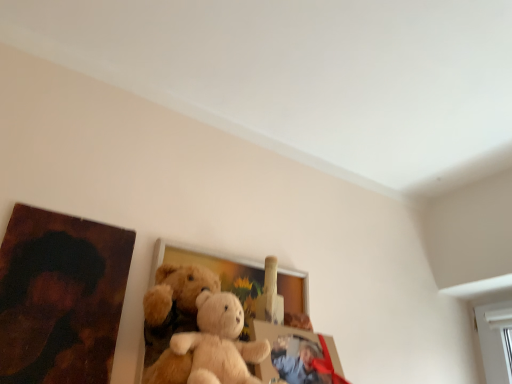
The height and width of the screenshot is (384, 512). I want to click on wooden painting at left, which ranks as the 3th picture frame in right-to-left order, so click(60, 297).

Identify the location of picture frame that is above the wooden picture frame at center, which is the 2th picture frame in right-to-left order (from the image's perspective). (60, 297).

Based on the photo, considering the relative positions of wooden picture frame at center, which is the 2th picture frame from left to right, and wooden painting at left, which ranks as the 3th picture frame in right-to-left order, in the image provided, is wooden picture frame at center, which is the 2th picture frame from left to right, behind wooden painting at left, which ranks as the 3th picture frame in right-to-left order,?

Yes.

Can you confirm if wooden picture frame at center, which is the 2th picture frame in right-to-left order, is positioned to the left of wooden painting at left, acting as the 1th picture frame starting from the left?

No, wooden picture frame at center, which is the 2th picture frame in right-to-left order, is not to the left of wooden painting at left, acting as the 1th picture frame starting from the left.

Can you confirm if matte plastic picture frame at center, the 1th picture frame from the right, is positioned to the left of wooden painting at left, acting as the 1th picture frame starting from the left?

No, matte plastic picture frame at center, the 1th picture frame from the right, is not to the left of wooden painting at left, acting as the 1th picture frame starting from the left.

Based on the photo, which object is closer to the camera, matte plastic picture frame at center, the 1th picture frame from the right, or wooden painting at left, which ranks as the 3th picture frame in right-to-left order?

Positioned in front is wooden painting at left, which ranks as the 3th picture frame in right-to-left order.

From their relative heights in the image, would you say matte plastic picture frame at center, the third picture frame viewed from the left, is taller or shorter than wooden painting at left, acting as the 1th picture frame starting from the left?

Considering their sizes, matte plastic picture frame at center, the third picture frame viewed from the left, has less height than wooden painting at left, acting as the 1th picture frame starting from the left.

Is matte plastic picture frame at center, the third picture frame viewed from the left, positioned beyond the bounds of wooden painting at left, acting as the 1th picture frame starting from the left?

Absolutely, matte plastic picture frame at center, the third picture frame viewed from the left, is external to wooden painting at left, acting as the 1th picture frame starting from the left.

Is wooden painting at left, acting as the 1th picture frame starting from the left, next to wooden picture frame at center, which is the 2th picture frame from left to right, and touching it?

They are not placed beside each other.

Who is smaller, wooden painting at left, acting as the 1th picture frame starting from the left, or wooden picture frame at center, which is the 2th picture frame from left to right?

Smaller between the two is wooden painting at left, acting as the 1th picture frame starting from the left.

Is point (109, 255) more distant than point (252, 284)?

No, it is in front of (252, 284).

Is wooden painting at left, acting as the 1th picture frame starting from the left, shorter than wooden picture frame at center, which is the 2th picture frame in right-to-left order?

Yes, wooden painting at left, acting as the 1th picture frame starting from the left, is shorter than wooden picture frame at center, which is the 2th picture frame in right-to-left order.

Is wooden picture frame at center, which is the 2th picture frame in right-to-left order, far away from matte plastic picture frame at center, the third picture frame viewed from the left?

No, wooden picture frame at center, which is the 2th picture frame in right-to-left order, is in close proximity to matte plastic picture frame at center, the third picture frame viewed from the left.

Is wooden picture frame at center, which is the 2th picture frame in right-to-left order, situated inside matte plastic picture frame at center, the third picture frame viewed from the left, or outside?

The correct answer is: outside.

Locate an element on the screen. The width and height of the screenshot is (512, 384). picture frame lying below the wooden picture frame at center, which is the 2th picture frame in right-to-left order (from the image's perspective) is located at coordinates (297, 356).

Is point (158, 367) farther from camera compared to point (272, 353)?

No, (158, 367) is closer to viewer.

Would you say matte plastic picture frame at center, the 1th picture frame from the right, is inside or outside wooden picture frame at center, which is the 2th picture frame from left to right?

matte plastic picture frame at center, the 1th picture frame from the right, is not inside wooden picture frame at center, which is the 2th picture frame from left to right, it's outside.

Is matte plastic picture frame at center, the third picture frame viewed from the left, looking in the opposite direction of wooden picture frame at center, which is the 2th picture frame from left to right?

Yes, matte plastic picture frame at center, the third picture frame viewed from the left, is positioned with its back facing wooden picture frame at center, which is the 2th picture frame from left to right.

Between matte plastic picture frame at center, the third picture frame viewed from the left, and wooden picture frame at center, which is the 2th picture frame in right-to-left order, which one has smaller width?

wooden picture frame at center, which is the 2th picture frame in right-to-left order.

Considering the positions of objects wooden painting at left, acting as the 1th picture frame starting from the left, and matte plastic picture frame at center, the 1th picture frame from the right, in the image provided, who is behind, wooden painting at left, acting as the 1th picture frame starting from the left, or matte plastic picture frame at center, the 1th picture frame from the right,?

matte plastic picture frame at center, the 1th picture frame from the right, is more distant.

How distant is wooden painting at left, which ranks as the 3th picture frame in right-to-left order, from matte plastic picture frame at center, the third picture frame viewed from the left?

15.82 inches.

From the image's perspective, is wooden painting at left, acting as the 1th picture frame starting from the left, located above or below matte plastic picture frame at center, the 1th picture frame from the right?

wooden painting at left, acting as the 1th picture frame starting from the left, is situated higher than matte plastic picture frame at center, the 1th picture frame from the right, in the image.

Would you say matte plastic picture frame at center, the third picture frame viewed from the left, is part of wooden painting at left, acting as the 1th picture frame starting from the left,'s contents?

That's incorrect, matte plastic picture frame at center, the third picture frame viewed from the left, is not inside wooden painting at left, acting as the 1th picture frame starting from the left.

The height and width of the screenshot is (384, 512). In order to click on picture frame that is the 2nd object located behind the wooden painting at left, which ranks as the 3th picture frame in right-to-left order in this screenshot , I will do `click(194, 295)`.

Locate an element on the screen. picture frame that is the 2nd one above the matte plastic picture frame at center, the 1th picture frame from the right (from a real-world perspective) is located at coordinates (60, 297).

Consider the image. Looking at the image, which one is located further to matte plastic picture frame at center, the third picture frame viewed from the left, wooden painting at left, which ranks as the 3th picture frame in right-to-left order, or wooden picture frame at center, which is the 2th picture frame in right-to-left order?

wooden painting at left, which ranks as the 3th picture frame in right-to-left order, is positioned further to the anchor matte plastic picture frame at center, the third picture frame viewed from the left.

When comparing their distances from wooden picture frame at center, which is the 2th picture frame from left to right, does matte plastic picture frame at center, the 1th picture frame from the right, or wooden painting at left, acting as the 1th picture frame starting from the left, seem closer?

matte plastic picture frame at center, the 1th picture frame from the right, lies closer to wooden picture frame at center, which is the 2th picture frame from left to right, than the other object.

From the picture: Looking at the image, which one is located further to wooden picture frame at center, which is the 2th picture frame in right-to-left order, wooden painting at left, which ranks as the 3th picture frame in right-to-left order, or matte plastic picture frame at center, the 1th picture frame from the right?

Among the two, wooden painting at left, which ranks as the 3th picture frame in right-to-left order, is located further to wooden picture frame at center, which is the 2th picture frame in right-to-left order.

From the image, which object appears to be nearer to matte plastic picture frame at center, the 1th picture frame from the right, wooden picture frame at center, which is the 2th picture frame in right-to-left order, or wooden painting at left, acting as the 1th picture frame starting from the left?

Based on the image, wooden picture frame at center, which is the 2th picture frame in right-to-left order, appears to be nearer to matte plastic picture frame at center, the 1th picture frame from the right.

Looking at the image, which one is located further to wooden painting at left, which ranks as the 3th picture frame in right-to-left order, wooden picture frame at center, which is the 2th picture frame from left to right, or matte plastic picture frame at center, the third picture frame viewed from the left?

Based on the image, matte plastic picture frame at center, the third picture frame viewed from the left, appears to be further to wooden painting at left, which ranks as the 3th picture frame in right-to-left order.

When comparing their distances from wooden painting at left, acting as the 1th picture frame starting from the left, does matte plastic picture frame at center, the 1th picture frame from the right, or wooden picture frame at center, which is the 2th picture frame in right-to-left order, seem closer?

The object closer to wooden painting at left, acting as the 1th picture frame starting from the left, is wooden picture frame at center, which is the 2th picture frame in right-to-left order.

Where is `picture frame between wooden painting at left, acting as the 1th picture frame starting from the left, and matte plastic picture frame at center, the 1th picture frame from the right, from left to right`? This screenshot has width=512, height=384. picture frame between wooden painting at left, acting as the 1th picture frame starting from the left, and matte plastic picture frame at center, the 1th picture frame from the right, from left to right is located at coordinates (194, 295).